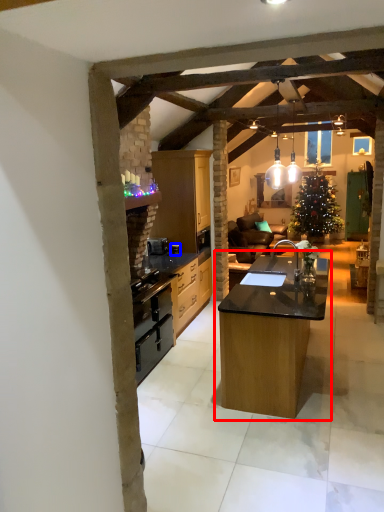
Question: Which of the following is the closest to the observer, table (highlighted by a red box) or appliance (highlighted by a blue box)?

Choices:
 (A) table
 (B) appliance

Answer: (A)